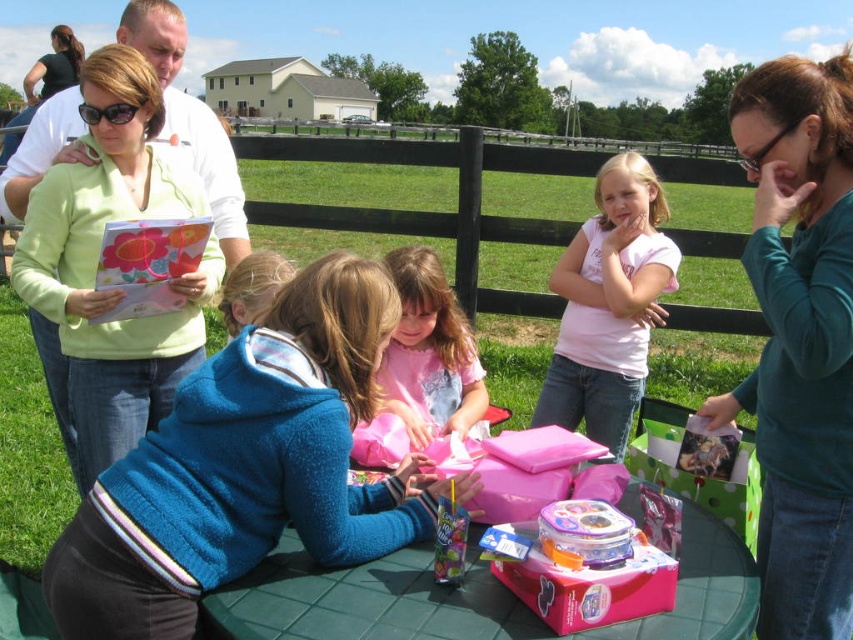
Can you confirm if green plastic table at center is wider than matte green hoodie at upper left?

In fact, green plastic table at center might be narrower than matte green hoodie at upper left.

Does point (210, 612) come behind point (242, 198)?

No, it is not.

I want to click on green plastic table at center, so click(x=370, y=600).

Looking at this image, who is more forward, (x=170, y=17) or (x=447, y=561)?

Point (x=447, y=561)

Is point (22, 179) less distant than point (456, 536)?

That is False.

The width and height of the screenshot is (853, 640). I want to click on matte green hoodie at upper left, so click(x=189, y=116).

Which is in front, point (817, 444) or point (509, 564)?

Point (509, 564) is in front.

Can you confirm if teal matte shirt at upper right is positioned below pink plastic container at center?

No, teal matte shirt at upper right is not below pink plastic container at center.

What are the coordinates of `teal matte shirt at upper right` in the screenshot? It's located at (799, 339).